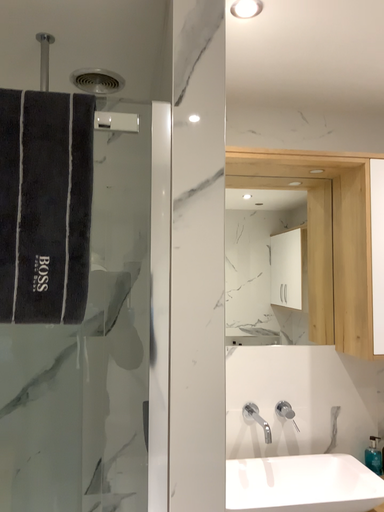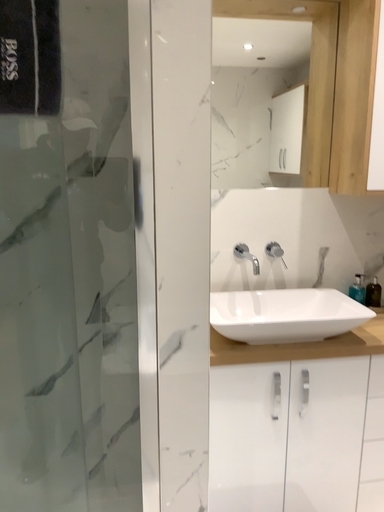
Question: Which way did the camera rotate in the video?

Choices:
 (A) rotated downward
 (B) rotated upward

Answer: (A)